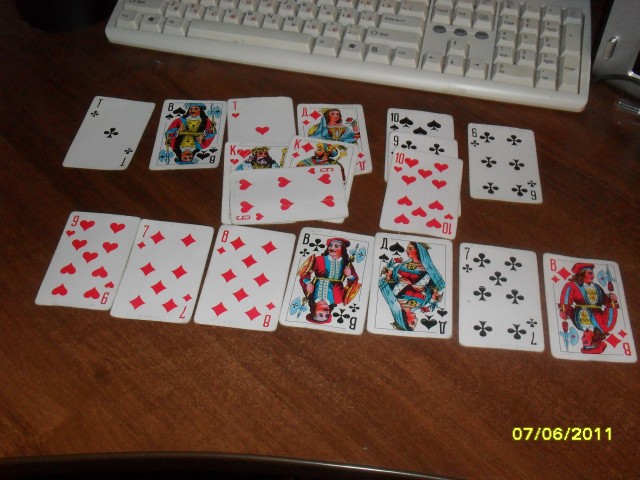
At what (x,y) coordinates should I click in order to perform the action: click on table trim. Please return your answer as a coordinate pair (x, y). Looking at the image, I should click on (44, 470), (185, 464), (355, 471).